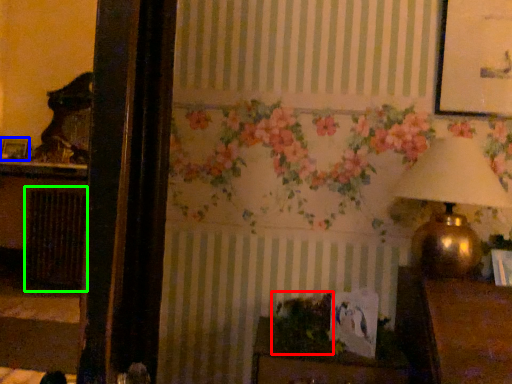
Question: Considering the real-world distances, which object is closest to plant (highlighted by a red box)? picture frame (highlighted by a blue box) or radiator (highlighted by a green box).

Choices:
 (A) picture frame
 (B) radiator

Answer: (B)